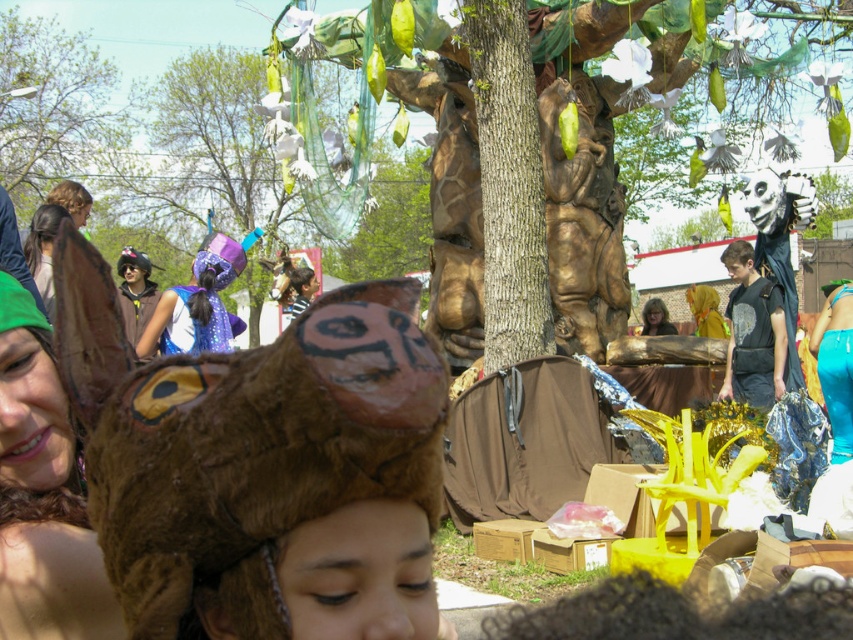
You are a photographer trying to capture a clear shot of the sparkly purple cape at center and the matte brown hair at center. Based on their positions, which object would you need to adjust your camera angle to focus on first?

The sparkly purple cape at center might be wider than matte brown hair at center, so you should focus on the sparkly purple cape at center first to ensure it fits within the frame.

You are a photographer at the festival and want to capture both the green fabric headband at upper left and the teal satin dress at lower right in a single frame. Which object should you focus on first to ensure both are in the frame?

You should focus on the teal satin dress at lower right first because it is larger than the green fabric headband at upper left, ensuring it fits within the frame while the smaller headband remains visible.